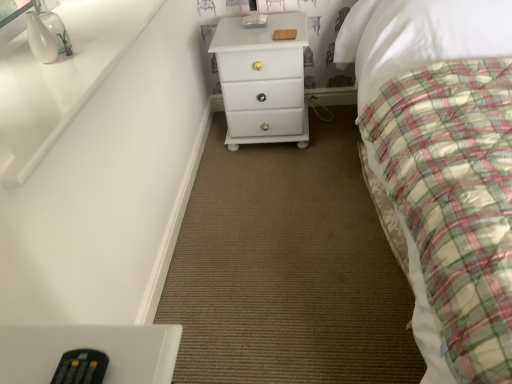
The height and width of the screenshot is (384, 512). Identify the location of free space above white glossy chest of drawers at center (from a real-world perspective). (261, 26).